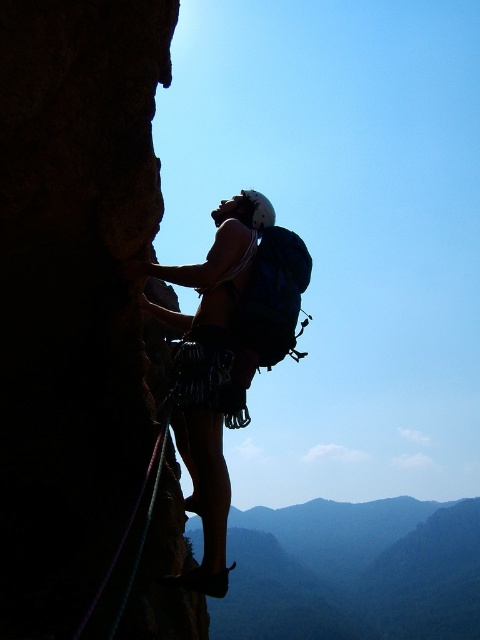
Based on the coordinates provided, where is the dark green textured mountain at lower center located in the image?

The dark green textured mountain at lower center is located at the coordinates point (352, 572).

Consider the image. You are a drone operator trying to capture the best aerial shot of the dark green textured mountain at lower center. The drone is currently at point A, which is at coordinates 0.8, 0.7. The mountain is represented by point B at (352, 572). To get the best shot, you need to move the drone 0.05 units closer to the mountain. What should be the new coordinates of the drone?

The new coordinates would be calculated by moving 0.05 units towards point B from point A. The difference in x is 0.894 minus 0.8 equals 0.094. The difference in y is 0.735 minus 0.7 equals 0.035. The distance between the points is sqrt of 0.094 squared plus 0.035 squared. To move 0.05 units closer, we calculate the unit vector in the direction from A to B. The unit vector components are 0.094 divided by distance and 0.035 divided by distance. Multiply each component by 0.05 and add to point A. The new x is

You are a hiker planning to reach the summit. You see the dark green textured mountain at lower center and the purple nylon rope at left. Which object is closer to you?

The dark green textured mountain at lower center is closer to you than the purple nylon rope at left.